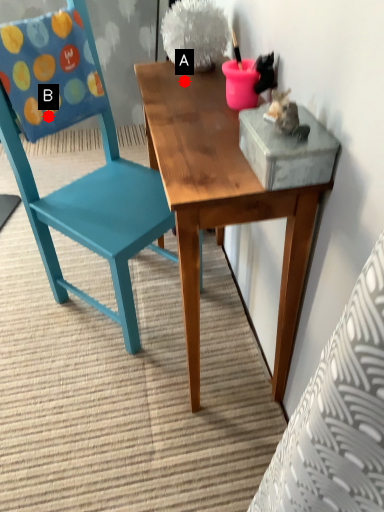
Question: Two points are circled on the image, labeled by A and B beside each circle. Which point is farther to the camera?

Choices:
 (A) A is further
 (B) B is further

Answer: (B)